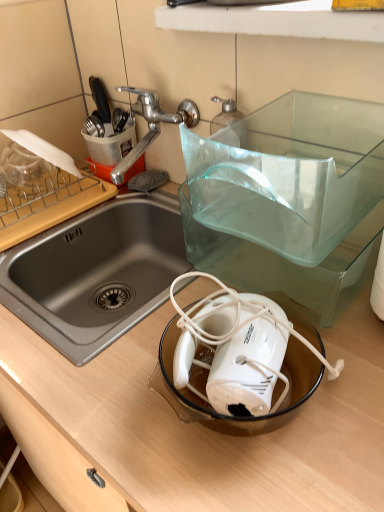
Identify the location of vacant space underneath white plastic mixer at center (from a real-world perspective). Image resolution: width=384 pixels, height=512 pixels. (234, 406).